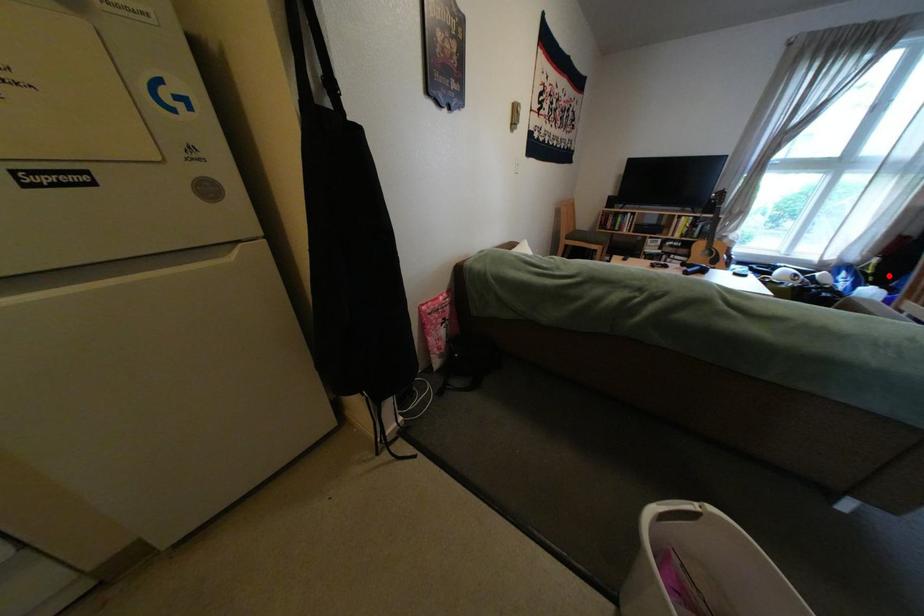
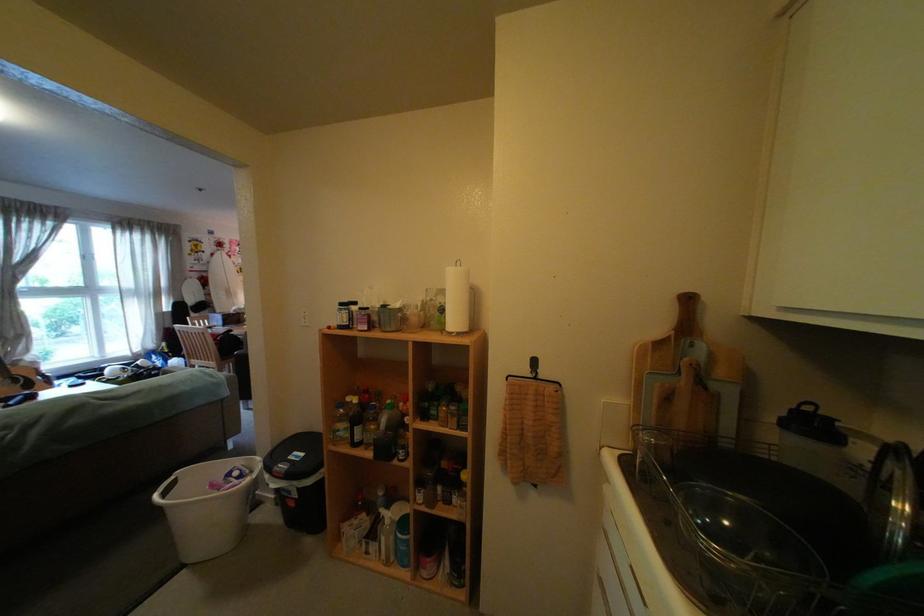
Question: I am providing you with two images of the same scene from different viewpoints. A red point is shown in image1. For the corresponding object point in image2, is it positioned nearer or farther from the camera?

Choices:
 (A) Nearer
 (B) Farther

Answer: (A)